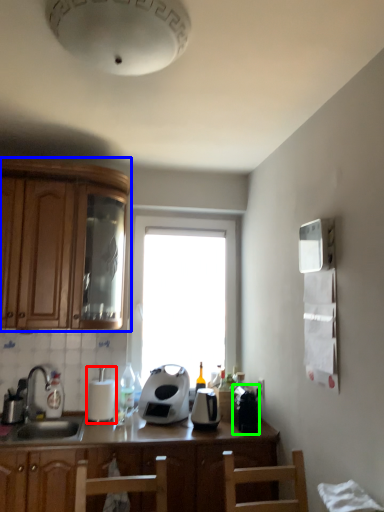
Question: Which object is the closest to the appliance (highlighted by a red box)? Choose among these: cabinetry (highlighted by a blue box) or coffee machine (highlighted by a green box).

Choices:
 (A) cabinetry
 (B) coffee machine

Answer: (A)